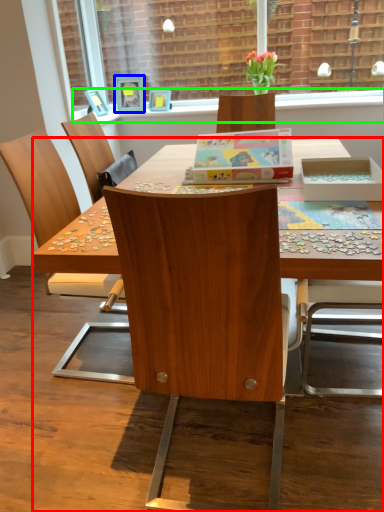
Question: Which object is positioned closest to desk (highlighted by a red box)? Select from picture frame (highlighted by a blue box) and window sill (highlighted by a green box).

Choices:
 (A) picture frame
 (B) window sill

Answer: (B)